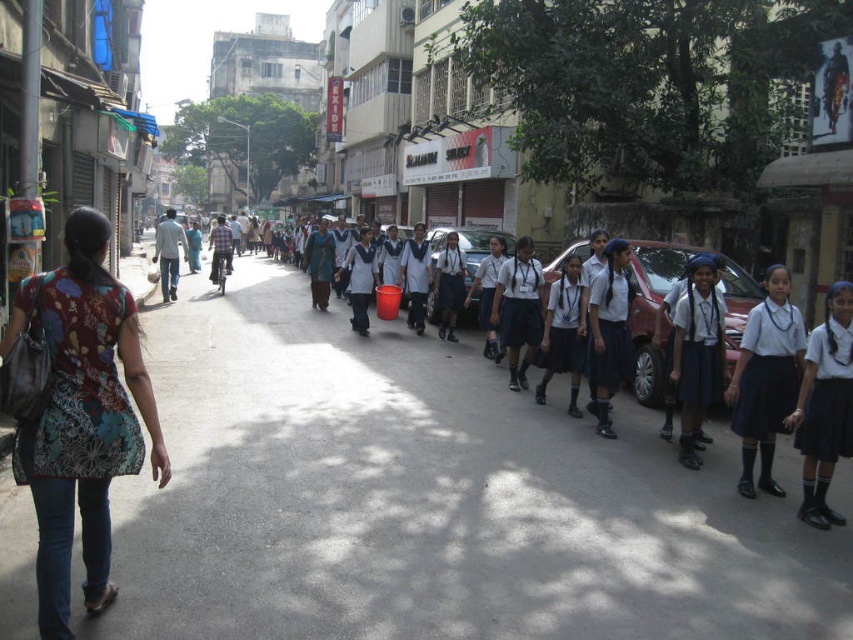
Question: From the image, what is the correct spatial relationship of white uniform students at center in relation to white fabric uniform at right?

Choices:
 (A) above
 (B) below

Answer: (A)

Question: Does white uniform students at center appear under white uniform skirt at center?

Choices:
 (A) no
 (B) yes

Answer: (B)

Question: Which of the following is the farthest from the observer?

Choices:
 (A) (84, 426)
 (B) (770, 356)
 (C) (317, 234)

Answer: (C)

Question: Is white uniform students at center bigger than printed fabric shirt at left?

Choices:
 (A) yes
 (B) no

Answer: (A)

Question: Which point is farther from the camera taking this photo?

Choices:
 (A) (801, 516)
 (B) (134, 432)
 (C) (310, 298)

Answer: (C)

Question: Which point appears farthest from the camera in this image?

Choices:
 (A) (828, 381)
 (B) (312, 248)
 (C) (47, 577)
 (D) (376, 330)

Answer: (B)